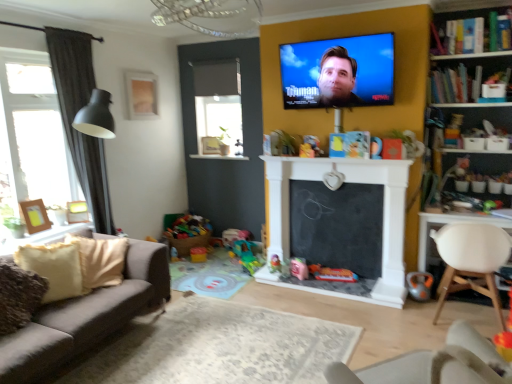
Question: Does dark grey fabric curtain at left have a lesser width compared to matte gold picture frame at upper left, which is the 1th picture frame in right-to-left order?

Choices:
 (A) no
 (B) yes

Answer: (A)

Question: Does dark grey fabric curtain at left turn towards matte gold picture frame at upper left, which is the 1th picture frame in right-to-left order?

Choices:
 (A) no
 (B) yes

Answer: (A)

Question: Does dark grey fabric curtain at left have a greater width compared to matte gold picture frame at upper left, positioned as the 3th picture frame in front-to-back order?

Choices:
 (A) yes
 (B) no

Answer: (A)

Question: From the image's perspective, is dark grey fabric curtain at left over matte gold picture frame at upper left, which is counted as the first picture frame, starting from the back?

Choices:
 (A) yes
 (B) no

Answer: (B)

Question: Would you say dark grey fabric curtain at left contains matte gold picture frame at upper left, which is counted as the first picture frame, starting from the back?

Choices:
 (A) yes
 (B) no

Answer: (B)

Question: Is the depth of dark grey fabric curtain at left greater than that of matte gold picture frame at upper left, which ranks as the first picture frame in top-to-bottom order?

Choices:
 (A) yes
 (B) no

Answer: (B)

Question: Is bright multicolored plastic toys at lower left, acting as the sixth toy starting from the bottom, facing away from plastic colorful toy at center, which is the second toy in bottom-to-top order?

Choices:
 (A) yes
 (B) no

Answer: (B)

Question: Is bright multicolored plastic toys at lower left, acting as the sixth toy starting from the bottom, taller than plastic colorful toy at center, which ranks as the sixth toy in top-to-bottom order?

Choices:
 (A) no
 (B) yes

Answer: (B)

Question: Is bright multicolored plastic toys at lower left, marked as the second toy in a left-to-right arrangement, bigger than plastic colorful toy at center, the second toy in the right-to-left sequence?

Choices:
 (A) yes
 (B) no

Answer: (A)

Question: Is bright multicolored plastic toys at lower left, which is counted as the 6th toy, starting from the right, positioned beyond the bounds of plastic colorful toy at center, placed as the 3th toy when sorted from front to back?

Choices:
 (A) no
 (B) yes

Answer: (B)

Question: Is the depth of bright multicolored plastic toys at lower left, marked as the 6th toy in a front-to-back arrangement, less than that of plastic colorful toy at center, the second toy in the right-to-left sequence?

Choices:
 (A) yes
 (B) no

Answer: (B)

Question: From the image's perspective, is bright multicolored plastic toys at lower left, marked as the 6th toy in a front-to-back arrangement, above plastic colorful toy at center, which is the second toy in bottom-to-top order?

Choices:
 (A) yes
 (B) no

Answer: (A)

Question: Is white plastic chair at lower right, which is the first chair in front-to-back order, oriented towards plush yellow toy at center, the 7th toy positioned from the bottom?

Choices:
 (A) yes
 (B) no

Answer: (A)